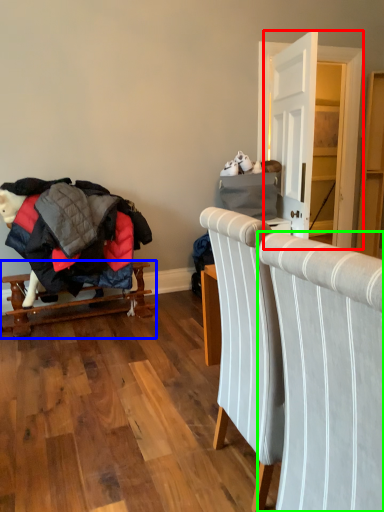
Question: Which is nearer to the dresser (highlighted by a red box)? furniture (highlighted by a blue box) or chair (highlighted by a green box).

Choices:
 (A) furniture
 (B) chair

Answer: (A)